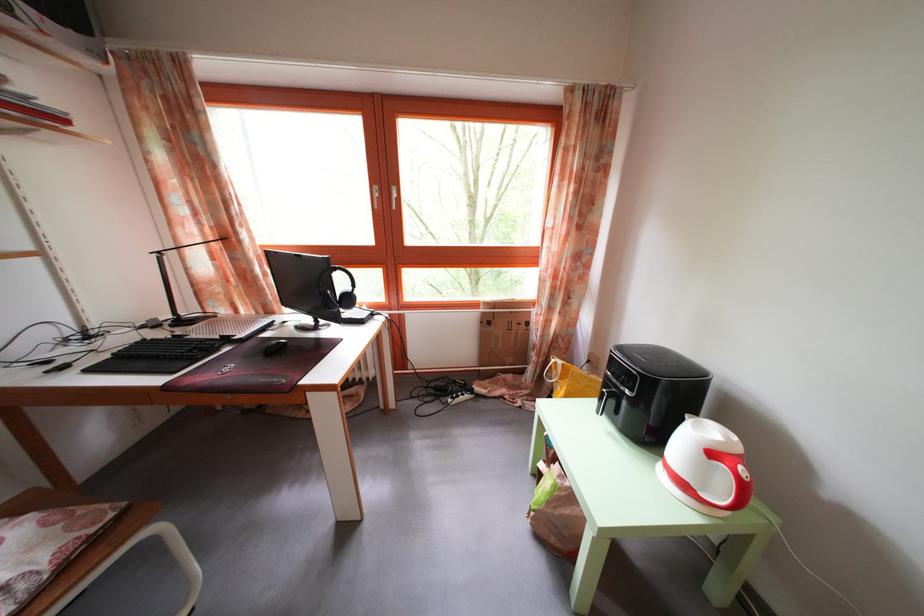
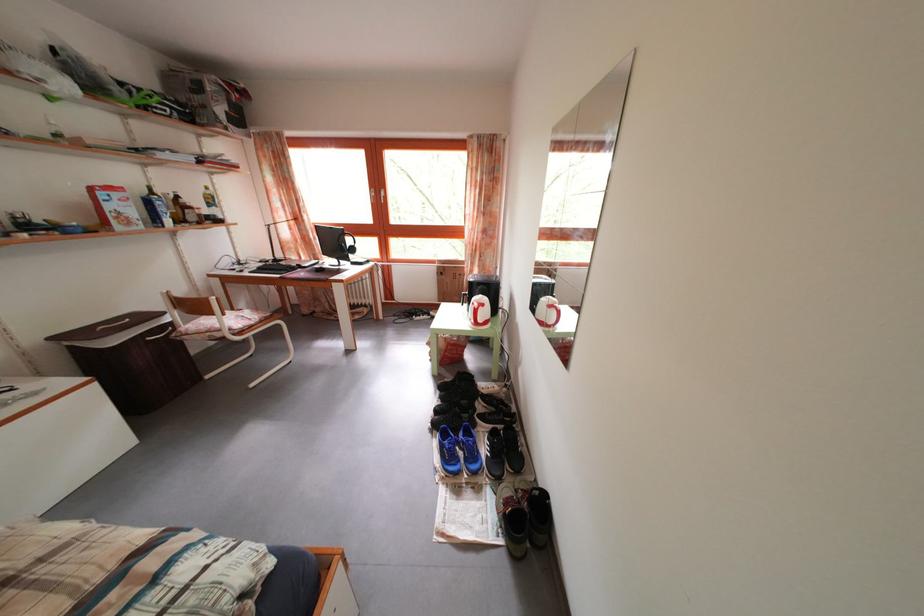
In a continuous first-person perspective shot, in which direction is the camera moving?

The movement direction of the cameraman is right, backward.